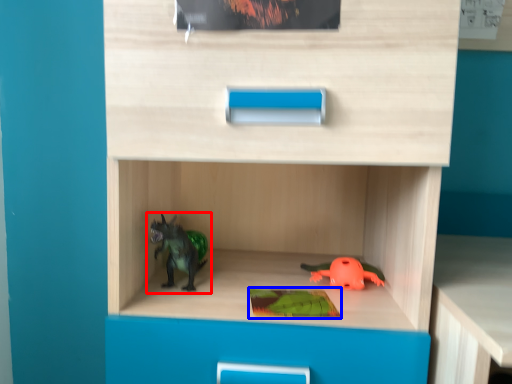
Question: Which point is closer to the camera, toy (highlighted by a red box) or paperback book (highlighted by a blue box)?

Choices:
 (A) toy
 (B) paperback book

Answer: (B)